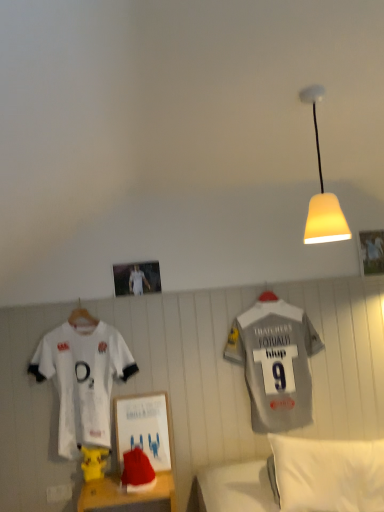
Find the location of a particular element. free space in front of yellow matte pikachu at lower left is located at coordinates (104, 492).